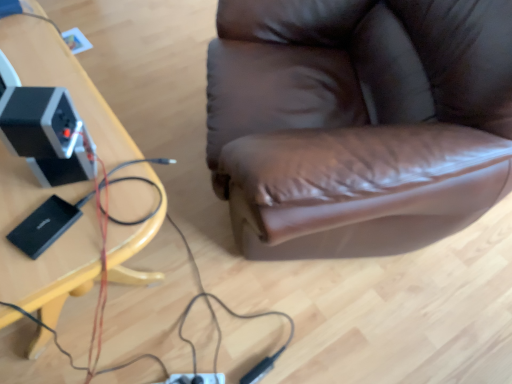
Question: Would you say black plastic speaker at left is to the left or to the right of wooden table at left in the picture?

Choices:
 (A) right
 (B) left

Answer: (A)

Question: From the image's perspective, relative to wooden table at left, is black plastic speaker at left above or below?

Choices:
 (A) above
 (B) below

Answer: (A)

Question: Based on their sizes in the image, would you say black plastic speaker at left is bigger or smaller than wooden table at left?

Choices:
 (A) big
 (B) small

Answer: (B)

Question: Based on their sizes in the image, would you say wooden table at left is bigger or smaller than black plastic speaker at left?

Choices:
 (A) big
 (B) small

Answer: (A)

Question: Is wooden table at left in front of or behind black plastic speaker at left in the image?

Choices:
 (A) front
 (B) behind

Answer: (A)

Question: Is point (141, 203) positioned closer to the camera than point (64, 140)?

Choices:
 (A) closer
 (B) farther

Answer: (B)

Question: From the image's perspective, relative to black plastic speaker at left, is wooden table at left above or below?

Choices:
 (A) above
 (B) below

Answer: (B)